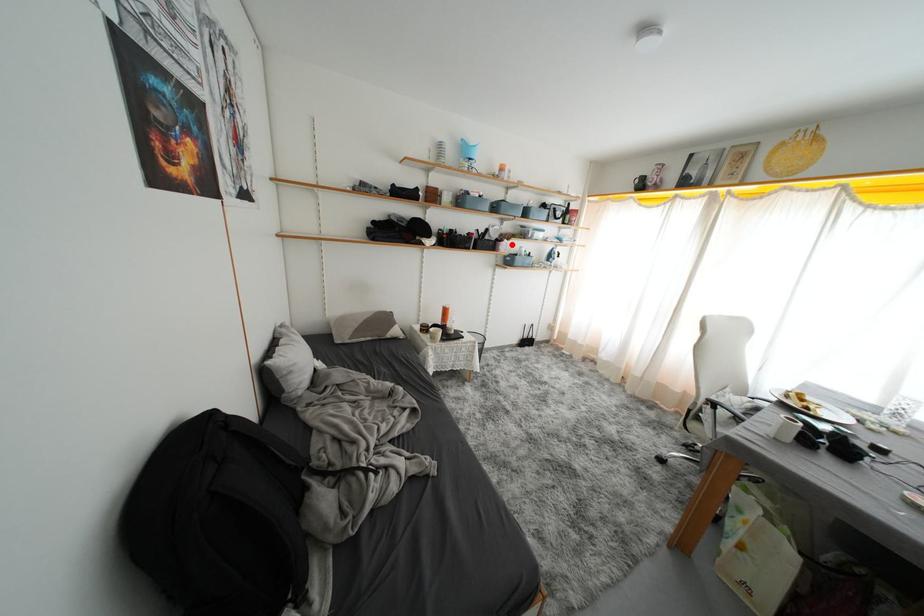
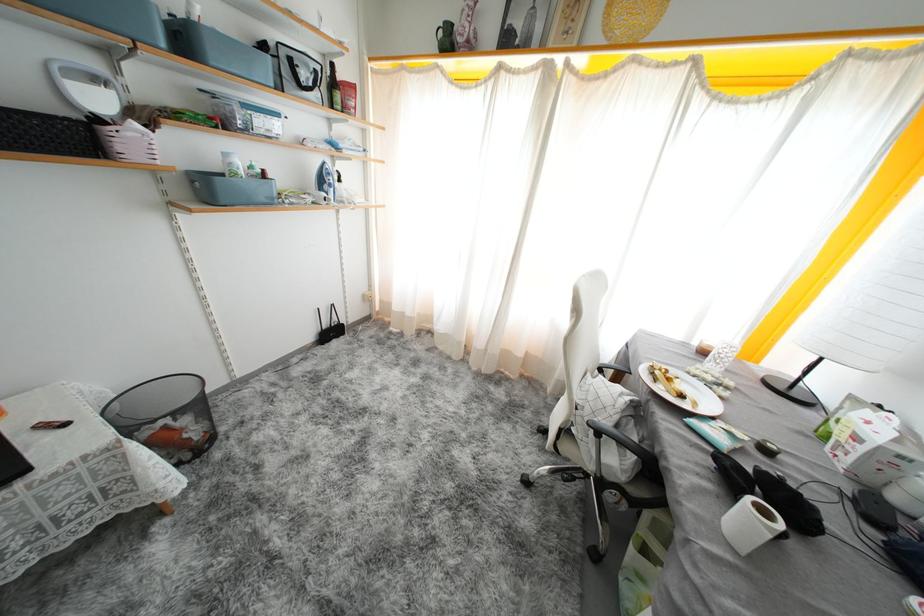
Question: I am providing you with two images of the same scene from different viewpoints. Image1 has a red point marked. In image2, the corresponding 3D location appears at what relative position? Reply with the corresponding letter.

Choices:
 (A) Closer
 (B) Farther

Answer: (B)